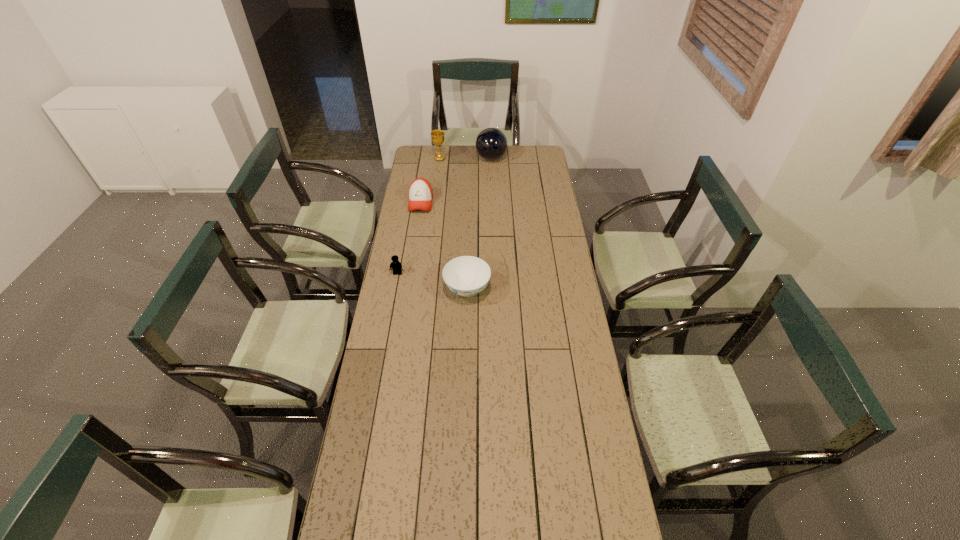
Where is `blank space that satisfies the following two spatial constraints: 1. on the front-facing side of the chinaware; 2. on the left side of the Lego`? blank space that satisfies the following two spatial constraints: 1. on the front-facing side of the chinaware; 2. on the left side of the Lego is located at coordinates (395, 289).

This screenshot has height=540, width=960. I want to click on vacant space that satisfies the following two spatial constraints: 1. on the side of the bowling ball with the finger holes; 2. on the front-facing side of the third farthest object, so click(x=492, y=202).

The image size is (960, 540). I want to click on vacant space that satisfies the following two spatial constraints: 1. on the front-facing side of the Lego; 2. on the right side of the chinaware, so click(395, 289).